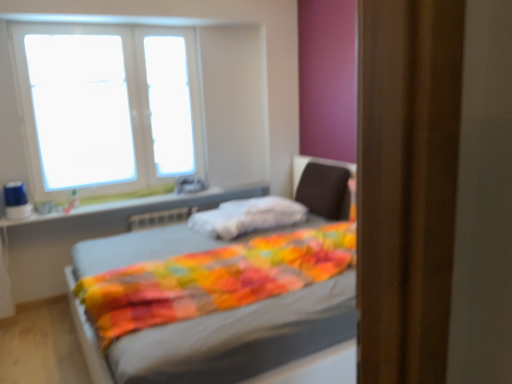
Question: Is dark brown fabric swivel chair at center at the right side of transparent glass window at upper left, the 1th window screen viewed from the left?

Choices:
 (A) yes
 (B) no

Answer: (A)

Question: From a real-world perspective, is dark brown fabric swivel chair at center positioned over transparent glass window at upper left, the 1th window screen viewed from the left, based on gravity?

Choices:
 (A) yes
 (B) no

Answer: (B)

Question: Can you confirm if dark brown fabric swivel chair at center is shorter than transparent glass window at upper left, the 1th window screen viewed from the left?

Choices:
 (A) no
 (B) yes

Answer: (B)

Question: Is dark brown fabric swivel chair at center thinner than transparent glass window at upper left, the 1th window screen viewed from the left?

Choices:
 (A) no
 (B) yes

Answer: (A)

Question: Could you tell me if dark brown fabric swivel chair at center is facing transparent glass window at upper left, marked as the second window screen in a right-to-left arrangement?

Choices:
 (A) no
 (B) yes

Answer: (B)

Question: Can you confirm if dark brown fabric swivel chair at center is bigger than transparent glass window at upper left, marked as the second window screen in a right-to-left arrangement?

Choices:
 (A) no
 (B) yes

Answer: (B)

Question: Considering the relative sizes of transparent glass window at upper center, the first window screen viewed from the right, and dark brown fabric swivel chair at center in the image provided, is transparent glass window at upper center, the first window screen viewed from the right, thinner than dark brown fabric swivel chair at center?

Choices:
 (A) no
 (B) yes

Answer: (B)

Question: Considering the relative positions of transparent glass window at upper center, the first window screen viewed from the right, and dark brown fabric swivel chair at center in the image provided, is transparent glass window at upper center, the first window screen viewed from the right, to the right of dark brown fabric swivel chair at center from the viewer's perspective?

Choices:
 (A) no
 (B) yes

Answer: (A)

Question: From a real-world perspective, is transparent glass window at upper center, the 2th window screen viewed from the left, physically below dark brown fabric swivel chair at center?

Choices:
 (A) yes
 (B) no

Answer: (B)

Question: Considering the relative sizes of transparent glass window at upper center, the 2th window screen viewed from the left, and dark brown fabric swivel chair at center in the image provided, is transparent glass window at upper center, the 2th window screen viewed from the left, smaller than dark brown fabric swivel chair at center?

Choices:
 (A) no
 (B) yes

Answer: (B)

Question: Can you confirm if transparent glass window at upper center, the 2th window screen viewed from the left, is bigger than dark brown fabric swivel chair at center?

Choices:
 (A) yes
 (B) no

Answer: (B)

Question: From the image's perspective, does transparent glass window at upper center, the 2th window screen viewed from the left, appear lower than dark brown fabric swivel chair at center?

Choices:
 (A) no
 (B) yes

Answer: (A)

Question: Considering the relative positions of multicolored quilted blanket at center and transparent glass window at upper center, the 2th window screen viewed from the left, in the image provided, is multicolored quilted blanket at center to the left of transparent glass window at upper center, the 2th window screen viewed from the left, from the viewer's perspective?

Choices:
 (A) no
 (B) yes

Answer: (A)